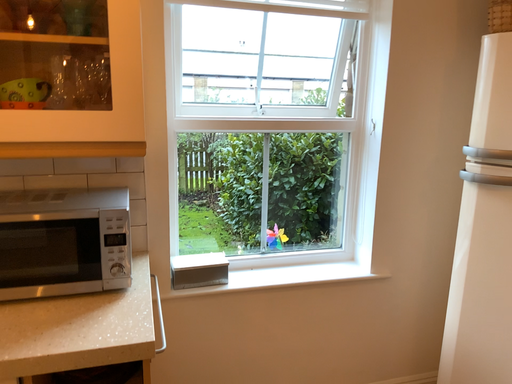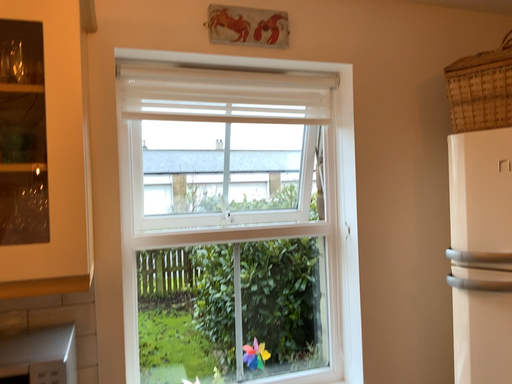
Question: How did the camera likely rotate when shooting the video?

Choices:
 (A) rotated upward
 (B) rotated downward

Answer: (A)